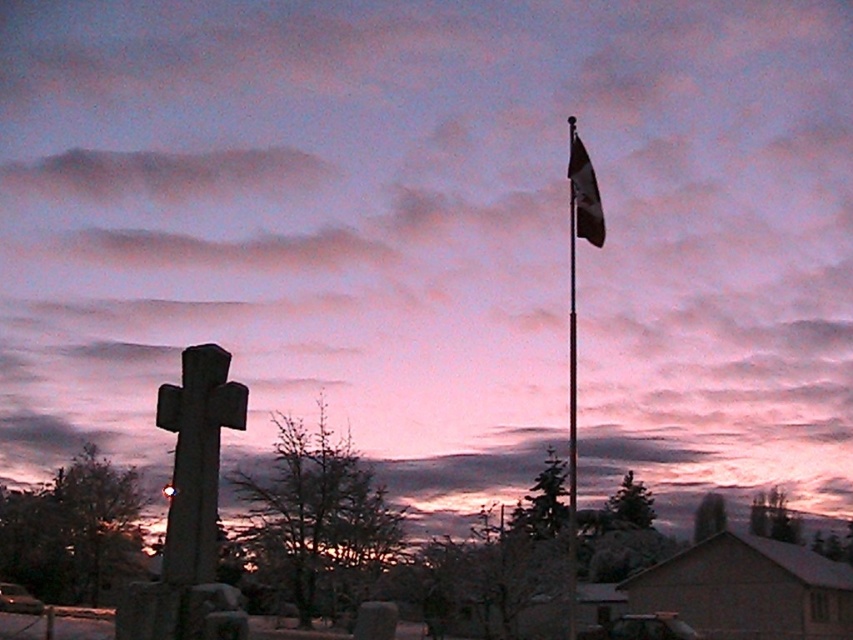
You are a maintenance worker who needs to reach both the metallic flagpole at right and the dark blue fabric flag at upper right. The maintenance cart you are using has a maximum range of 10 meters. Can you reach both objects with your current equipment?

→ The metallic flagpole at right is 11.16 meters away from the dark blue fabric flag at upper right. Since the cart has a maximum range of 10 meters, you cannot reach both objects simultaneously. You may need to move closer to one or use additional equipment.

You are a bird looking for a place to perch. You see a metallic pole at upper right and a metallic flagpole at right. Which one is shorter?

The metallic pole at upper right is shorter than the metallic flagpole at right.

You are a photographer trying to capture the metallic pole at upper right and the dark blue fabric flag at upper right in a single shot. Based on their positions, which object should you focus on first to ensure both are in frame?

The metallic pole at upper right is located below the dark blue fabric flag at upper right, so you should focus on the dark blue fabric flag at upper right first to ensure both are in frame.